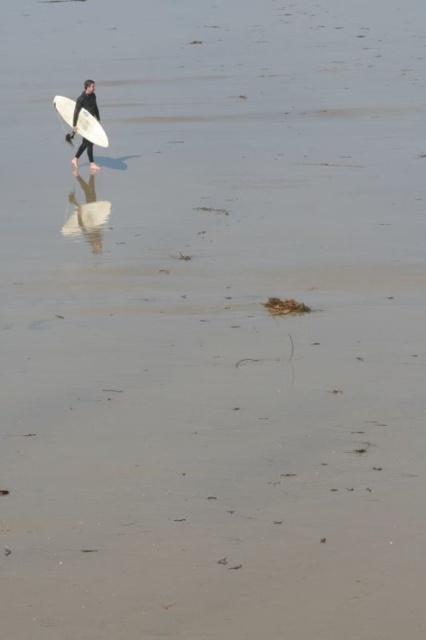
Is white matte surfboard at center to the left of black matte wetsuit at upper left from the viewer's perspective?

Indeed, white matte surfboard at center is positioned on the left side of black matte wetsuit at upper left.

Is white matte surfboard at center wider than black matte wetsuit at upper left?

Yes.

Image resolution: width=426 pixels, height=640 pixels. Find the location of `white matte surfboard at center`. white matte surfboard at center is located at coordinates tap(91, 129).